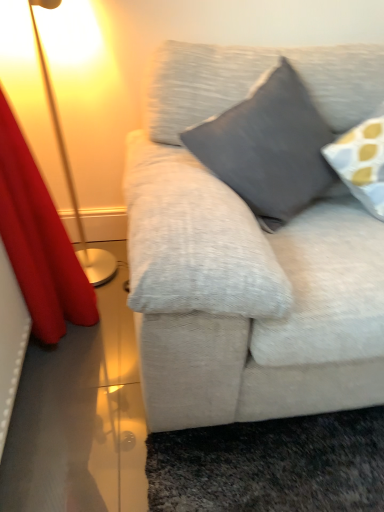
The width and height of the screenshot is (384, 512). I want to click on free spot in front of red velvet curtain at left, so click(x=75, y=433).